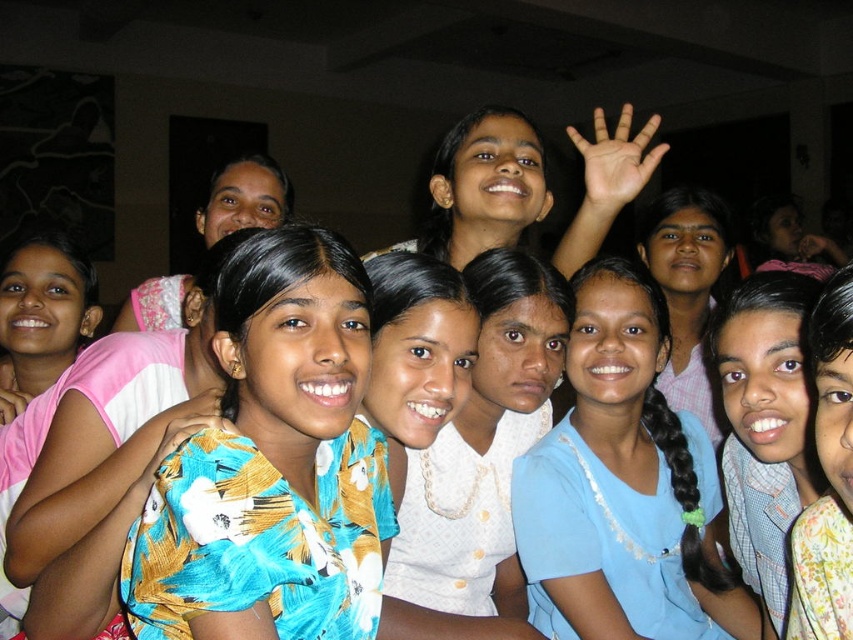
Question: Estimate the real-world distances between objects in this image. Which object is farther from the matte pink blouse at upper left?

Choices:
 (A) blue printed shirt at center
 (B) matte yellow shirt at center
 (C) blue fabric at center
 (D) floral fabric shirt at center

Answer: (D)

Question: Which object is closer to the camera taking this photo?

Choices:
 (A) floral fabric shirt at center
 (B) blue fabric at center

Answer: (A)

Question: Can you confirm if blue fabric at center is wider than blue printed shirt at center?

Choices:
 (A) yes
 (B) no

Answer: (A)

Question: Is blue fabric at center bigger than matte pink blouse at upper left?

Choices:
 (A) yes
 (B) no

Answer: (B)

Question: Estimate the real-world distances between objects in this image. Which object is closer to the blue fabric at center?

Choices:
 (A) floral fabric shirt at center
 (B) matte pink blouse at upper left

Answer: (A)

Question: Does matte pink blouse at upper left have a lesser width compared to brown skin hand at upper center?

Choices:
 (A) no
 (B) yes

Answer: (B)